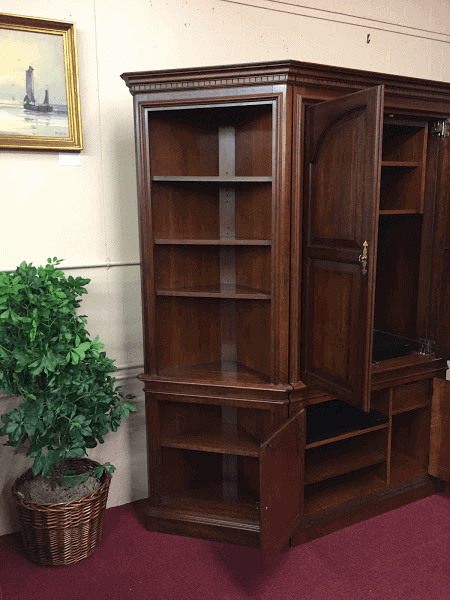
At what (x,y) coordinates should I click in order to perform the action: click on latch. Please return your answer as a coordinate pair (x, y). This screenshot has width=450, height=600. Looking at the image, I should click on (268, 444).